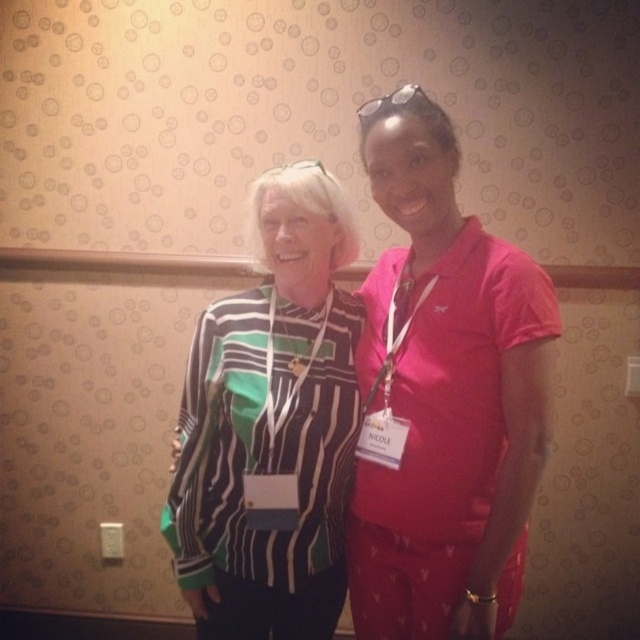
Question: Which point is closer to the camera?

Choices:
 (A) (305, 493)
 (B) (376, 132)

Answer: (B)

Question: Is pink matte shirt at center below striped knit sweater at center?

Choices:
 (A) yes
 (B) no

Answer: (B)

Question: Is pink matte shirt at center positioned before striped knit sweater at center?

Choices:
 (A) no
 (B) yes

Answer: (B)

Question: Can you confirm if pink matte shirt at center is positioned above striped knit sweater at center?

Choices:
 (A) no
 (B) yes

Answer: (B)

Question: Among these points, which one is nearest to the camera?

Choices:
 (A) [x=253, y=417]
 (B) [x=531, y=464]

Answer: (B)